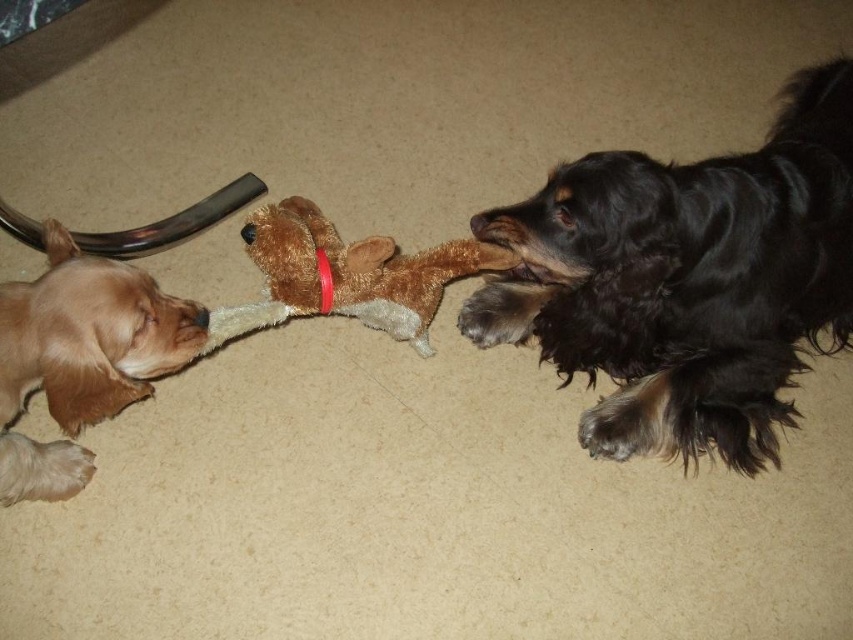
Between black silky dog at right and light brown fur at left, which one is positioned higher?

black silky dog at right

Does black silky dog at right have a greater width compared to light brown fur at left?

Yes.

Who is more forward, (x=821, y=314) or (x=86, y=296)?

Positioned in front is point (x=86, y=296).

The width and height of the screenshot is (853, 640). In order to click on black silky dog at right in this screenshot , I will do `click(686, 280)`.

Is black silky dog at right thinner than brown plush toy at center?

No, black silky dog at right is not thinner than brown plush toy at center.

Is black silky dog at right bigger than brown plush toy at center?

Indeed, black silky dog at right has a larger size compared to brown plush toy at center.

Is point (850, 84) positioned behind point (329, 312)?

Yes.

Where is `black silky dog at right`? black silky dog at right is located at coordinates (686, 280).

From the picture: Who is more forward, [131,369] or [280,266]?

Positioned in front is point [131,369].

Is light brown fur at left thinner than brown plush toy at center?

Yes.

Describe the element at coordinates (80, 356) in the screenshot. The width and height of the screenshot is (853, 640). I see `light brown fur at left` at that location.

The width and height of the screenshot is (853, 640). I want to click on light brown fur at left, so click(80, 356).